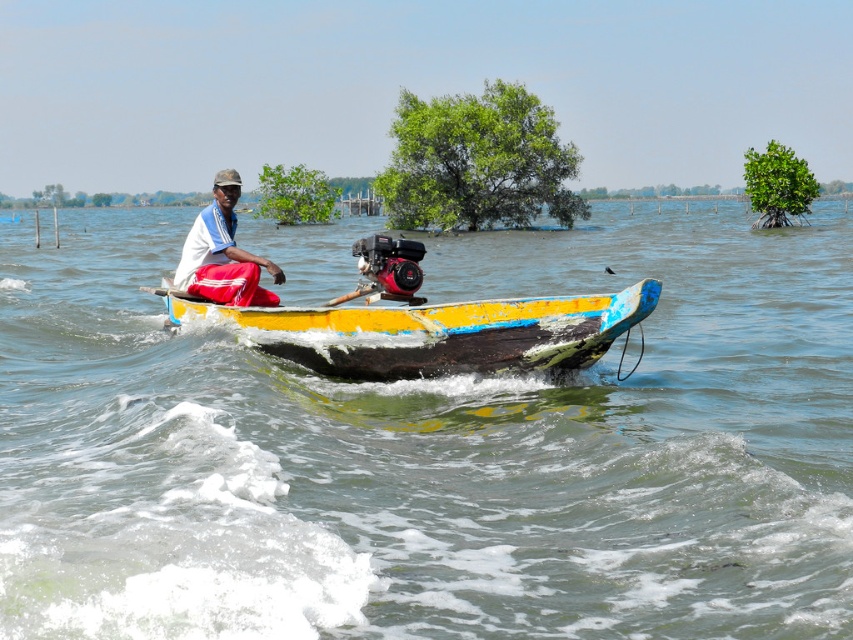
You are a passenger on the yellow painted wood canoe at center. You notice the white fabric shirt at center of the person steering the boat. How does the height of the canoe compare to the shirt?

The yellow painted wood canoe at center is taller than the white fabric shirt at center.

You are a passenger on the boat and want to know which object takes up more space in the image. Which one is larger between the clear water at boat front and the white fabric shirt at center?

The clear water at boat front is bigger than the white fabric shirt at center, so the clear water at boat front takes up more space in the image.

You are standing on the shore and see the clear water at boat front and the yellow painted wood canoe at center. Which object is closer to you?

The clear water at boat front is closer to you than the yellow painted wood canoe at center.